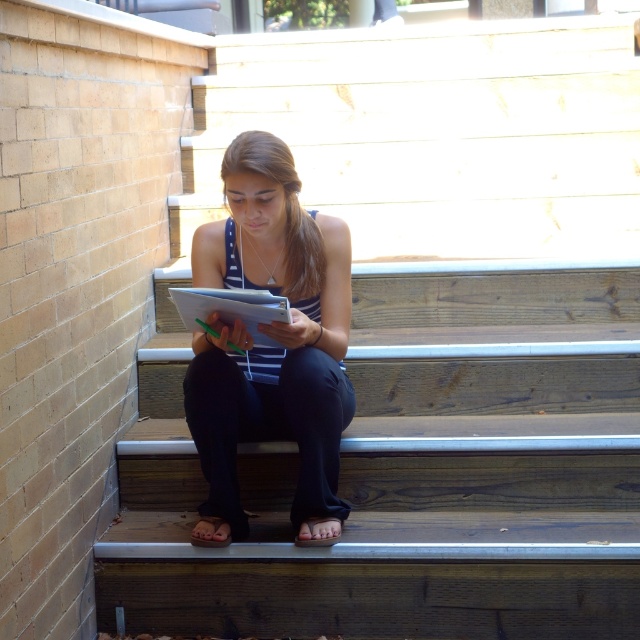
Question: Does matte black notebook at center have a lesser width compared to white paper at center?

Choices:
 (A) yes
 (B) no

Answer: (B)

Question: Which point is farther to the camera?

Choices:
 (A) matte black notebook at center
 (B) white paper at center

Answer: (A)

Question: Which point appears farthest from the camera in this image?

Choices:
 (A) (202, 296)
 (B) (244, 531)

Answer: (B)

Question: Can you confirm if matte black notebook at center is bigger than white paper at center?

Choices:
 (A) no
 (B) yes

Answer: (B)

Question: Observing the image, what is the correct spatial positioning of matte black notebook at center in reference to white paper at center?

Choices:
 (A) below
 (B) above

Answer: (A)